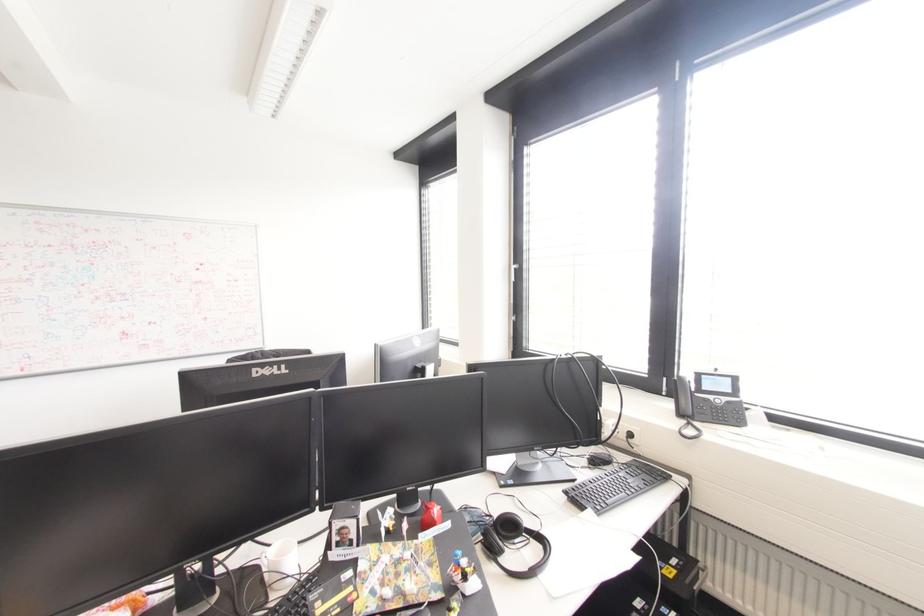
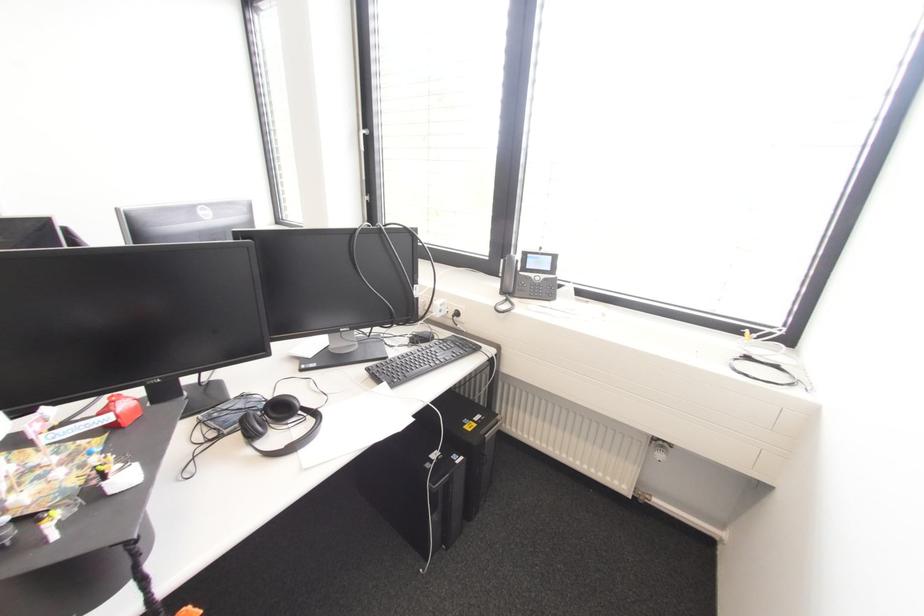
Find the pixel in the second image that matches point 514,265 in the first image.

(361, 132)